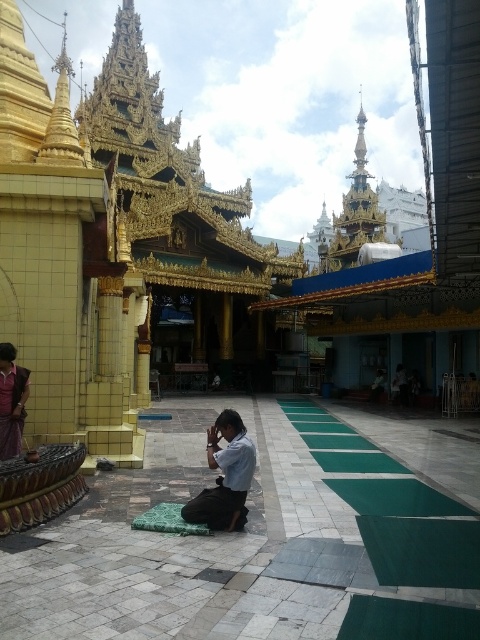
Question: Does light blue fabric at center appear under matte purple shirt at left?

Choices:
 (A) no
 (B) yes

Answer: (B)

Question: Does light blue fabric at center appear over matte purple shirt at left?

Choices:
 (A) yes
 (B) no

Answer: (B)

Question: Which point is closer to the camera?

Choices:
 (A) (222, 520)
 (B) (10, 397)

Answer: (A)

Question: Where is light blue fabric at center located in relation to matte purple shirt at left in the image?

Choices:
 (A) above
 (B) below

Answer: (B)